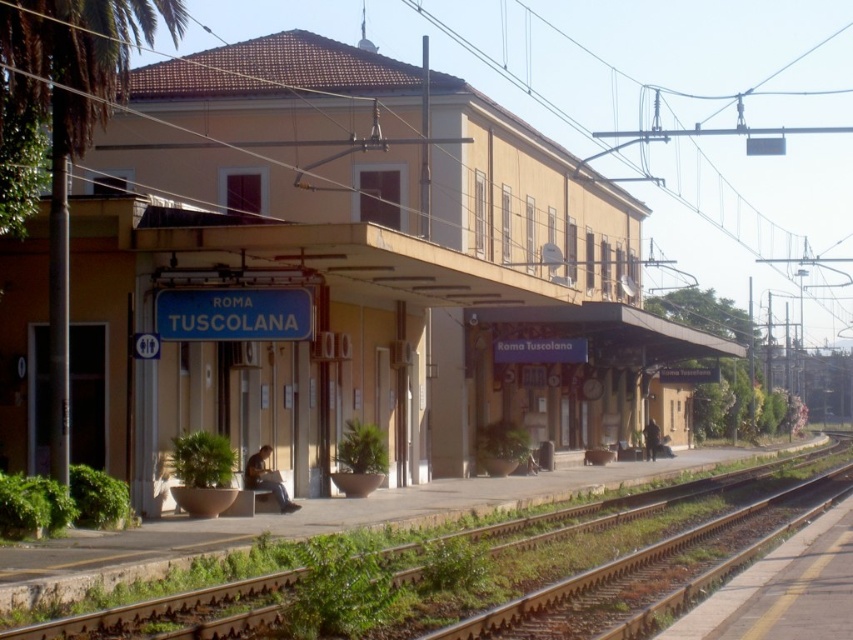
You are standing at point (570, 609) on the platform at Roma Tuscolana station. You need to walk to point (402, 116). Which direction should you move relative to your current position?

You should move forward because point (402, 116) is behind point (570, 609), meaning it is in the direction you are facing from your current position.

Based on the photo, you are a photographer standing on the platform at Roma Tuscolana station. You want to capture a photo that includes both the green leafy palm tree at left and the brown gravel track at lower right. Which object should you adjust your camera angle to focus on first if you want to ensure both are in the frame?

The green leafy palm tree at left is thinner than the brown gravel track at lower right, so you should focus on the brown gravel track at lower right first to ensure both fit in the frame.

You are standing at the Roma Tuscolana railway station and want to find the green grass at lower left and the green leafy palm tree at left. Based on their positions, which object is closer to the platform edge?

The green grass at lower left is closer to the platform edge because it is to the right of the green leafy palm tree at left, which would place it nearer to the edge compared to the palm tree.